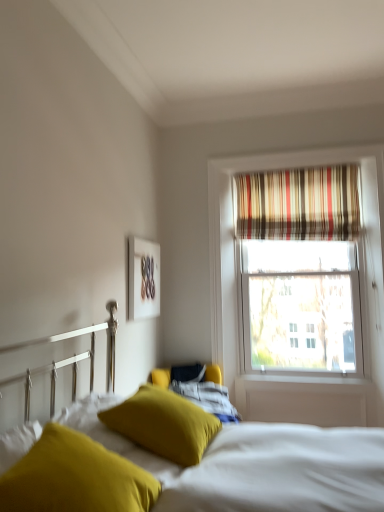
Question: Is soft yellow pillow at lower left smaller than mustard yellow fabric pillow at lower left, acting as the first pillow starting from the front?

Choices:
 (A) yes
 (B) no

Answer: (B)

Question: Is soft yellow pillow at lower left to the right of mustard yellow fabric pillow at lower left, placed as the second pillow when sorted from back to front, from the viewer's perspective?

Choices:
 (A) yes
 (B) no

Answer: (A)

Question: Are soft yellow pillow at lower left and mustard yellow fabric pillow at lower left, acting as the first pillow starting from the front, located far from each other?

Choices:
 (A) no
 (B) yes

Answer: (A)

Question: From the image's perspective, is soft yellow pillow at lower left on top of mustard yellow fabric pillow at lower left, placed as the second pillow when sorted from back to front?

Choices:
 (A) yes
 (B) no

Answer: (B)

Question: Is soft yellow pillow at lower left wider than mustard yellow fabric pillow at lower left, acting as the first pillow starting from the front?

Choices:
 (A) no
 (B) yes

Answer: (B)

Question: Is white matte picture frame at upper center inside the boundaries of soft yellow pillow at lower left, or outside?

Choices:
 (A) outside
 (B) inside

Answer: (A)

Question: Visually, is white matte picture frame at upper center positioned to the left or to the right of soft yellow pillow at lower left?

Choices:
 (A) right
 (B) left

Answer: (B)

Question: From a real-world perspective, is white matte picture frame at upper center positioned above or below soft yellow pillow at lower left?

Choices:
 (A) below
 (B) above

Answer: (B)

Question: In terms of size, does white matte picture frame at upper center appear bigger or smaller than soft yellow pillow at lower left?

Choices:
 (A) small
 (B) big

Answer: (A)

Question: From a real-world perspective, relative to soft yellow pillow at lower left, is mustard yellow fabric pillow at lower left, placed as the second pillow when sorted from back to front, vertically above or below?

Choices:
 (A) below
 (B) above

Answer: (B)

Question: From the image's perspective, relative to soft yellow pillow at lower left, is mustard yellow fabric pillow at lower left, acting as the first pillow starting from the front, above or below?

Choices:
 (A) below
 (B) above

Answer: (B)

Question: Looking at their shapes, would you say mustard yellow fabric pillow at lower left, acting as the first pillow starting from the front, is wider or thinner than soft yellow pillow at lower left?

Choices:
 (A) wide
 (B) thin

Answer: (B)

Question: In terms of size, does mustard yellow fabric pillow at lower left, placed as the second pillow when sorted from back to front, appear bigger or smaller than soft yellow pillow at lower left?

Choices:
 (A) small
 (B) big

Answer: (A)

Question: Is mustard yellow fabric pillow at center, placed as the second pillow when sorted from front to back, spatially inside mustard yellow fabric pillow at lower left, placed as the second pillow when sorted from back to front, or outside of it?

Choices:
 (A) inside
 (B) outside

Answer: (B)

Question: Considering the positions of mustard yellow fabric pillow at center, the first pillow viewed from the back, and mustard yellow fabric pillow at lower left, placed as the second pillow when sorted from back to front, in the image, is mustard yellow fabric pillow at center, the first pillow viewed from the back, bigger or smaller than mustard yellow fabric pillow at lower left, placed as the second pillow when sorted from back to front,?

Choices:
 (A) small
 (B) big

Answer: (B)